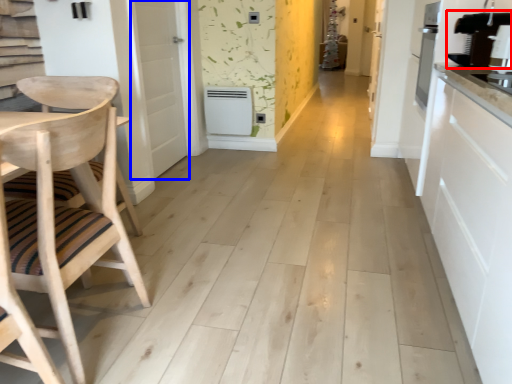
Question: Among these objects, which one is nearest to the camera, coffee machine (highlighted by a red box) or door (highlighted by a blue box)?

Choices:
 (A) coffee machine
 (B) door

Answer: (A)